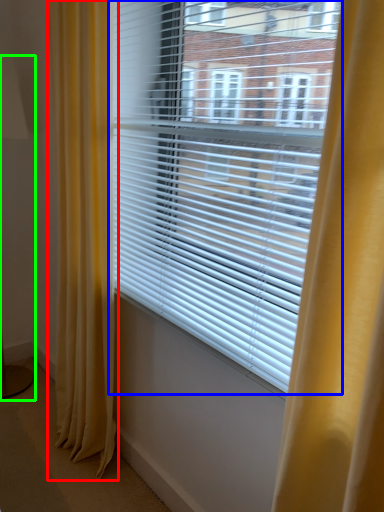
Question: Which is farther away from curtain (highlighted by a red box)? window blind (highlighted by a blue box) or table lamp (highlighted by a green box)?

Choices:
 (A) window blind
 (B) table lamp

Answer: (B)